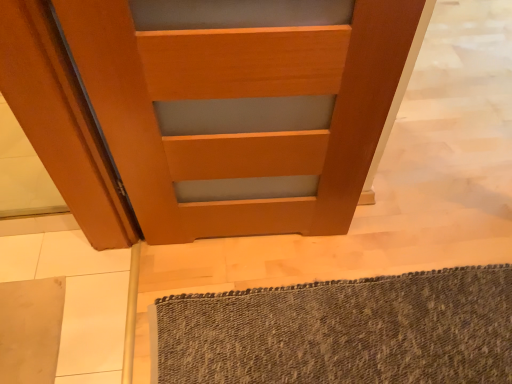
Describe the element at coordinates (239, 102) in the screenshot. I see `wooden door at center` at that location.

This screenshot has width=512, height=384. Find the location of `wooden door at center`. wooden door at center is located at coordinates (239, 102).

This screenshot has width=512, height=384. Describe the element at coordinates (344, 331) in the screenshot. I see `textured gray bath mat at lower right` at that location.

Locate an element on the screen. This screenshot has height=384, width=512. textured gray bath mat at lower right is located at coordinates (344, 331).

Locate an element on the screen. The height and width of the screenshot is (384, 512). wooden door at center is located at coordinates (239, 102).

Can you confirm if wooden door at center is positioned to the left of textured gray bath mat at lower right?

Indeed, wooden door at center is positioned on the left side of textured gray bath mat at lower right.

Which object is more forward, wooden door at center or textured gray bath mat at lower right?

wooden door at center is closer to the camera.

Does point (160, 225) appear closer or farther from the camera than point (246, 375)?

Point (160, 225) appears to be farther away from the viewer than point (246, 375).

From the image's perspective, does wooden door at center appear higher than textured gray bath mat at lower right?

Indeed, from the image's perspective, wooden door at center is shown above textured gray bath mat at lower right.

From a real-world perspective, is wooden door at center on top of textured gray bath mat at lower right?

Yes.

Which object is thinner, wooden door at center or textured gray bath mat at lower right?

wooden door at center is thinner.

Considering the sizes of objects wooden door at center and textured gray bath mat at lower right in the image provided, who is shorter, wooden door at center or textured gray bath mat at lower right?

Standing shorter between the two is textured gray bath mat at lower right.

Does wooden door at center have a larger size compared to textured gray bath mat at lower right?

Indeed, wooden door at center has a larger size compared to textured gray bath mat at lower right.

Is wooden door at center positioned beyond the bounds of textured gray bath mat at lower right?

Yes, wooden door at center is outside of textured gray bath mat at lower right.

Is wooden door at center in contact with textured gray bath mat at lower right?

No, wooden door at center is not beside textured gray bath mat at lower right.

Is wooden door at center facing towards textured gray bath mat at lower right?

Yes, wooden door at center is aimed at textured gray bath mat at lower right.

What's the angular difference between wooden door at center and textured gray bath mat at lower right's facing directions?

180 degrees separate the facing orientations of wooden door at center and textured gray bath mat at lower right.

Find the location of a particular element. bath mat below the wooden door at center (from the image's perspective) is located at coordinates (344, 331).

Considering the relative positions of textured gray bath mat at lower right and wooden door at center in the image provided, is textured gray bath mat at lower right to the right of wooden door at center from the viewer's perspective?

Yes, textured gray bath mat at lower right is to the right of wooden door at center.

Between textured gray bath mat at lower right and wooden door at center, which one is positioned behind?

textured gray bath mat at lower right is further from the camera.

Which is farther, (284, 326) or (72, 16)?

Point (284, 326)

From the image's perspective, which one is positioned lower, textured gray bath mat at lower right or wooden door at center?

textured gray bath mat at lower right.

From a real-world perspective, is textured gray bath mat at lower right physically located above or below wooden door at center?

In terms of real-world spatial position, textured gray bath mat at lower right is below wooden door at center.

Which of these two, textured gray bath mat at lower right or wooden door at center, is thinner?

With smaller width is wooden door at center.

Between textured gray bath mat at lower right and wooden door at center, which one has less height?

textured gray bath mat at lower right is shorter.

Considering the relative sizes of textured gray bath mat at lower right and wooden door at center in the image provided, is textured gray bath mat at lower right smaller than wooden door at center?

Yes.

Can wooden door at center be found inside textured gray bath mat at lower right?

No.

Is textured gray bath mat at lower right next to wooden door at center and touching it?

textured gray bath mat at lower right and wooden door at center are clearly separated.

Is textured gray bath mat at lower right facing towards wooden door at center?

No, textured gray bath mat at lower right is not aimed at wooden door at center.

Measure the distance between textured gray bath mat at lower right and wooden door at center.

19.57 inches.

Where is `door that appears above the textured gray bath mat at lower right (from a real-world perspective)`? The image size is (512, 384). door that appears above the textured gray bath mat at lower right (from a real-world perspective) is located at coordinates (239, 102).

Locate an element on the screen. Image resolution: width=512 pixels, height=384 pixels. bath mat below the wooden door at center (from a real-world perspective) is located at coordinates (344, 331).

Locate an element on the screen. bath mat on the right of wooden door at center is located at coordinates (344, 331).